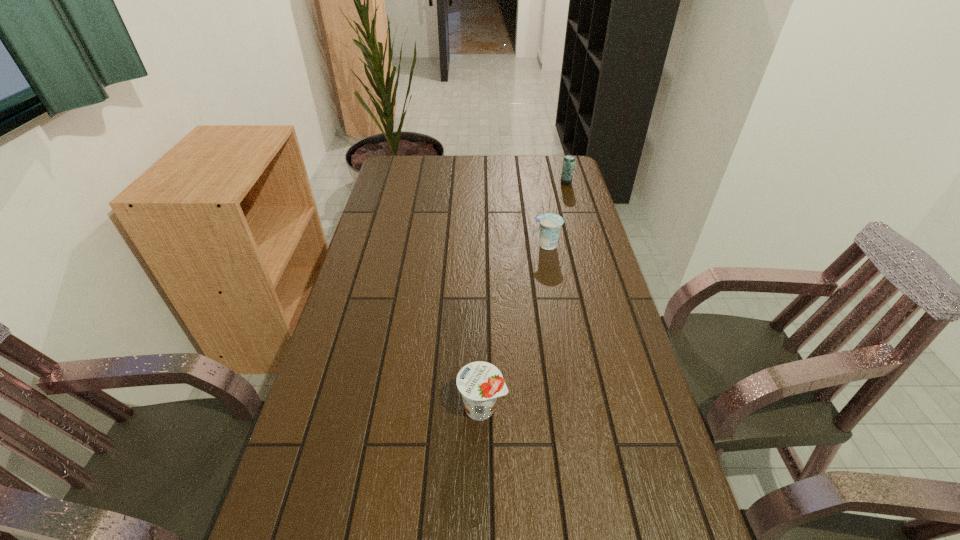
At what (x,y) coordinates should I click in order to perform the action: click on vacant area between the nearer yogurt and the beer can. Please return your answer as a coordinate pair (x, y). This screenshot has height=540, width=960. Looking at the image, I should click on (524, 295).

This screenshot has height=540, width=960. I want to click on empty space that is in between the leftmost object and the beer can, so click(524, 295).

Where is `vacant area between the second nearest object and the leftmost object`? This screenshot has width=960, height=540. vacant area between the second nearest object and the leftmost object is located at coordinates (514, 327).

Find the location of a particular element. unoccupied area between the right yogurt and the left yogurt is located at coordinates (514, 327).

This screenshot has height=540, width=960. I want to click on free spot between the leftmost object and the beer can, so click(524, 295).

Locate an element on the screen. The width and height of the screenshot is (960, 540). the second closest object to the beer can is located at coordinates (480, 383).

Where is `object that is the second closest to the beer can`? object that is the second closest to the beer can is located at coordinates (480, 383).

Locate an element on the screen. This screenshot has height=540, width=960. vacant space that satisfies the following two spatial constraints: 1. on the back side of the second farthest object; 2. on the right side of the rightmost object is located at coordinates (535, 183).

Locate an element on the screen. Image resolution: width=960 pixels, height=540 pixels. free region that satisfies the following two spatial constraints: 1. on the back side of the nearer yogurt; 2. on the left side of the beer can is located at coordinates (481, 183).

Locate an element on the screen. Image resolution: width=960 pixels, height=540 pixels. vacant space that satisfies the following two spatial constraints: 1. on the back side of the leftmost object; 2. on the right side of the beer can is located at coordinates (481, 183).